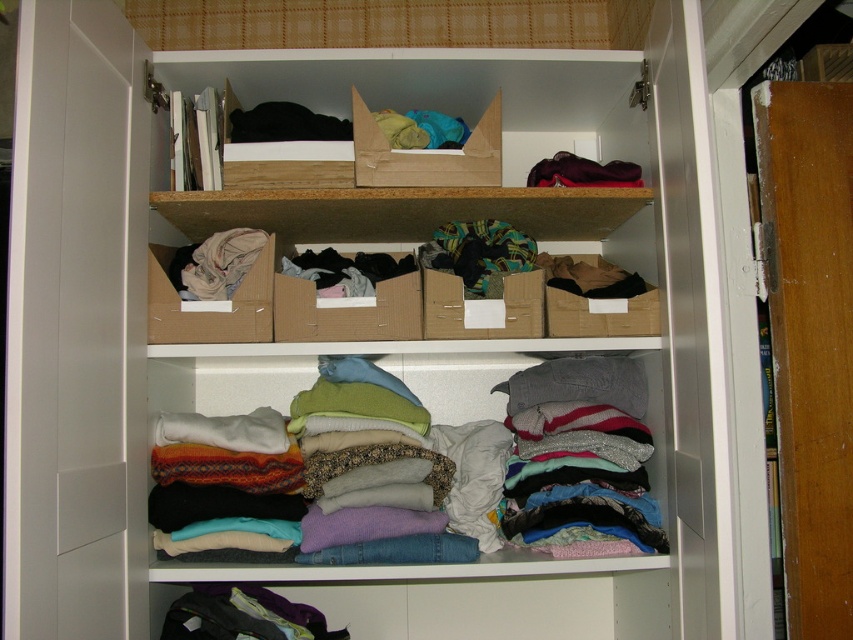
Does soft cotton sweaters at center have a lesser height compared to black fabric at upper center?

Incorrect, soft cotton sweaters at center's height does not fall short of black fabric at upper center's.

Between point (163, 429) and point (257, 115), which one is positioned in front?

Point (163, 429)

Locate an element on the screen. Image resolution: width=853 pixels, height=640 pixels. soft cotton sweaters at center is located at coordinates (433, 465).

At what (x,y) coordinates should I click in order to perform the action: click on soft cotton sweaters at center. Please return your answer as a coordinate pair (x, y). The height and width of the screenshot is (640, 853). Looking at the image, I should click on 433,465.

Between black fabric at upper center and dark purple fabric at upper center, which one is positioned lower?

Positioned lower is dark purple fabric at upper center.

Which is in front, point (252, 140) or point (558, 179)?

Positioned in front is point (252, 140).

The height and width of the screenshot is (640, 853). What are the coordinates of `black fabric at upper center` in the screenshot? It's located at (285, 124).

Is soft cotton sweaters at center thinner than cardboard box at center?

In fact, soft cotton sweaters at center might be wider than cardboard box at center.

Describe the element at coordinates (433, 465) in the screenshot. I see `soft cotton sweaters at center` at that location.

At what (x,y) coordinates should I click in order to perform the action: click on soft cotton sweaters at center. Please return your answer as a coordinate pair (x, y). The height and width of the screenshot is (640, 853). Looking at the image, I should click on (433, 465).